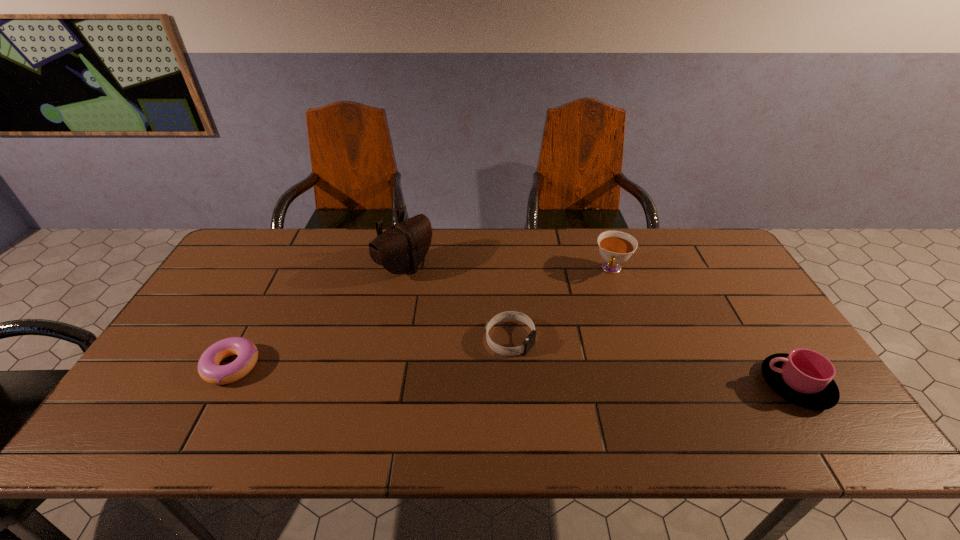
This screenshot has width=960, height=540. In order to click on doughnut in this screenshot , I will do `click(209, 369)`.

Identify the location of cup. (804, 377).

In order to click on the third shortest object in this screenshot , I will do `click(804, 377)`.

At what (x,y) coordinates should I click in order to perform the action: click on the third object from left to right. Please return your answer as a coordinate pair (x, y). The image size is (960, 540). Looking at the image, I should click on (528, 343).

The height and width of the screenshot is (540, 960). Find the location of `the second tallest object`. the second tallest object is located at coordinates (616, 247).

Where is `the fourth object from left to right`? This screenshot has width=960, height=540. the fourth object from left to right is located at coordinates (616, 247).

Locate an element on the screen. pouch is located at coordinates (401, 248).

The width and height of the screenshot is (960, 540). What are the coordinates of `the second object from left to right` in the screenshot? It's located at (401, 248).

Find the location of a particular element. Image resolution: width=960 pixels, height=540 pixels. free location located on the right of the leftmost object is located at coordinates (301, 366).

Identify the location of free space located on the side with the handle of the cup. Image resolution: width=960 pixels, height=540 pixels. (611, 385).